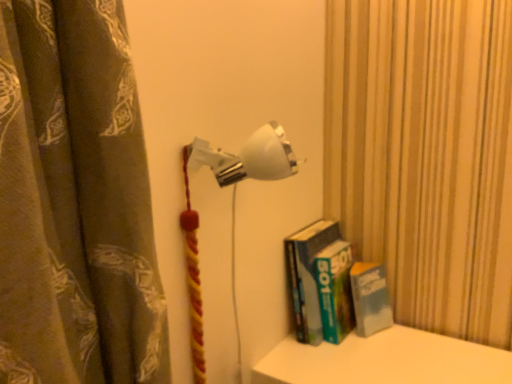
What do you see at coordinates (320, 283) in the screenshot?
I see `hardcover book at center` at bounding box center [320, 283].

Where is `hardcover book at center`? hardcover book at center is located at coordinates (320, 283).

Locate an element on the screen. hardcover book at center is located at coordinates (320, 283).